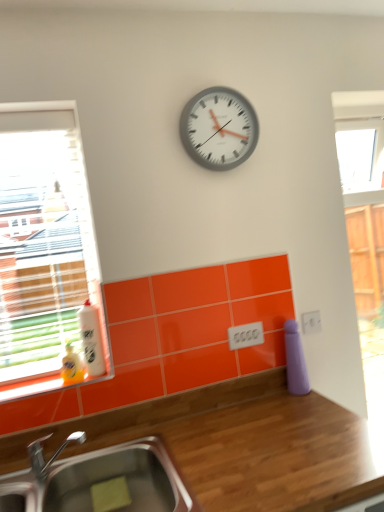
Find the location of `wooden at upper center`. wooden at upper center is located at coordinates (237, 444).

The image size is (384, 512). What do you see at coordinates (92, 339) in the screenshot?
I see `white glossy bottle at left` at bounding box center [92, 339].

In order to face orange glossy window sill at lower left, should I rotate leftwards or rightwards?

To face it directly, rotate left by 18.535 degrees.

In order to face stainless steel sink at lower left, should I rotate leftwards or rightwards?

To align with it, rotate left about 14.371°.

What are the coordinates of `wooden at upper center` in the screenshot? It's located at (237, 444).

In the image, is stainless steel sink at lower left on the left side or the right side of orange glossy window sill at lower left?

stainless steel sink at lower left is to the right of orange glossy window sill at lower left.

Image resolution: width=384 pixels, height=512 pixels. In order to click on window sill on the left side of stainless steel sink at lower left in this screenshot , I will do `click(32, 387)`.

Is there a large distance between stainless steel sink at lower left and orange glossy window sill at lower left?

They are positioned close to each other.

Is white plastic clock at upper center oriented towards wooden at upper center?

No, white plastic clock at upper center is not facing towards wooden at upper center.

Who is bigger, white plastic clock at upper center or wooden at upper center?

Bigger between the two is wooden at upper center.

Looking at this image, visually, is white plastic clock at upper center positioned to the left or to the right of wooden at upper center?

white plastic clock at upper center is to the left of wooden at upper center.

From a real-world perspective, which is physically below, white plastic clock at upper center or wooden at upper center?

From a 3D spatial view, wooden at upper center is below.

How different are the orientations of white plastic clock at upper center and orange glossy window sill at lower left in degrees?

They differ by 0.000209 degrees in their facing directions.

From the image's perspective, does white plastic clock at upper center appear higher than orange glossy window sill at lower left?

Correct, white plastic clock at upper center appears higher than orange glossy window sill at lower left in the image.

Is point (242, 141) positioned before point (97, 377)?

No, (242, 141) is further to viewer.

Which is further, (249, 390) or (95, 353)?

The point (249, 390) is more distant.

Find the location of `bottle positioned vertically above the wooden at upper center (from a real-world perspective)`. bottle positioned vertically above the wooden at upper center (from a real-world perspective) is located at coordinates (92, 339).

Measure the distance between wooden at upper center and white glossy bottle at left.

wooden at upper center is 19.01 inches away from white glossy bottle at left.

Is wooden at upper center facing away from white glossy bottle at left?

wooden at upper center does not have its back to white glossy bottle at left.

Would you say wooden at upper center is outside orange glossy window sill at lower left?

Absolutely, wooden at upper center is external to orange glossy window sill at lower left.

From the image's perspective, which is below, wooden at upper center or orange glossy window sill at lower left?

wooden at upper center.

Considering the sizes of objects wooden at upper center and orange glossy window sill at lower left in the image provided, who is bigger, wooden at upper center or orange glossy window sill at lower left?

wooden at upper center.

Would you say wooden at upper center is a long distance from orange glossy window sill at lower left?

No, wooden at upper center is not far away from orange glossy window sill at lower left.

Can you see orange glossy window sill at lower left touching wooden at upper center?

No, orange glossy window sill at lower left is not next to wooden at upper center.

Can you confirm if orange glossy window sill at lower left is wider than wooden at upper center?

No, orange glossy window sill at lower left is not wider than wooden at upper center.

From the image's perspective, which one is positioned lower, orange glossy window sill at lower left or wooden at upper center?

wooden at upper center, from the image's perspective.

How far apart are clear glass window at left and white glossy bottle at left?

clear glass window at left and white glossy bottle at left are 10.24 inches apart.

Based on the photo, between clear glass window at left and white glossy bottle at left, which one has smaller size?

white glossy bottle at left is smaller.

Is clear glass window at left at the right side of white glossy bottle at left?

No, clear glass window at left is not to the right of white glossy bottle at left.

You are a GUI agent. You are given a task and a screenshot of the screen. Output one action in this format:
    pyautogui.click(x=<x>, y=<y>)
    Task: Click on the bottle located behind the clear glass window at left
    The image size is (384, 512).
    Given the screenshot: What is the action you would take?
    pyautogui.click(x=92, y=339)

You are a GUI agent. You are given a task and a screenshot of the screen. Output one action in this format:
    pyautogui.click(x=<x>, y=<y>)
    Task: Click on the window sill on the left of stainless steel sink at lower left
    The image size is (384, 512).
    Given the screenshot: What is the action you would take?
    pyautogui.click(x=32, y=387)

I want to click on wall clock behind the wooden at upper center, so click(x=219, y=128).

Looking at the image, which one is located closer to white plastic clock at upper center, orange glossy window sill at lower left or wooden at upper center?

orange glossy window sill at lower left lies closer to white plastic clock at upper center than the other object.

From the image, which object appears to be farther from clear glass window at left, orange glossy window sill at lower left or white plastic clock at upper center?

The object further to clear glass window at left is white plastic clock at upper center.

Considering their positions, is stainless steel sink at lower left positioned closer to white glossy bottle at left than white plastic clock at upper center?

Among the two, stainless steel sink at lower left is located nearer to white glossy bottle at left.

In the scene shown: When comparing their distances from stainless steel sink at lower left, does white glossy bottle at left or wooden at upper center seem further?

white glossy bottle at left is positioned further to the anchor stainless steel sink at lower left.

Which object lies nearer to the anchor point white glossy bottle at left, stainless steel sink at lower left or orange glossy window sill at lower left?

Based on the image, orange glossy window sill at lower left appears to be nearer to white glossy bottle at left.

Estimate the real-world distances between objects in this image. Which object is closer to wooden at upper center, orange glossy window sill at lower left or white glossy bottle at left?

orange glossy window sill at lower left lies closer to wooden at upper center than the other object.

Based on their spatial positions, is stainless steel sink at lower left or clear glass window at left further from orange glossy window sill at lower left?

clear glass window at left is further to orange glossy window sill at lower left.

Based on their spatial positions, is orange glossy window sill at lower left or white glossy bottle at left further from stainless steel sink at lower left?

white glossy bottle at left is positioned further to the anchor stainless steel sink at lower left.

Image resolution: width=384 pixels, height=512 pixels. I want to click on window between white plastic clock at upper center and white glossy bottle at left in the vertical direction, so click(x=45, y=248).

Find the location of a particular element. window sill that lies between white plastic clock at upper center and stainless steel sink at lower left from top to bottom is located at coordinates (32, 387).

Find the location of a particular element. This screenshot has width=384, height=512. sink between white plastic clock at upper center and wooden at upper center vertically is located at coordinates (99, 481).

Identify the location of window sill between clear glass window at left and wooden at upper center in the horizontal direction. Image resolution: width=384 pixels, height=512 pixels. (32, 387).